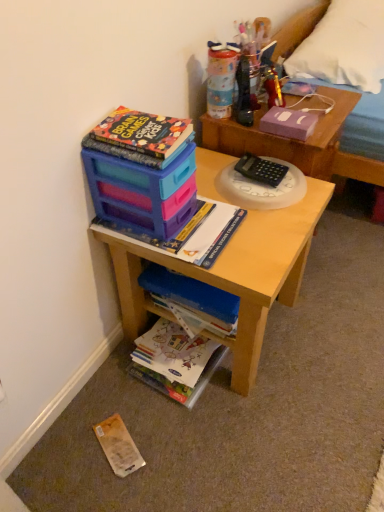
Locate an element on the screen. This screenshot has height=512, width=384. vacant area that is in front of colored paper art at lower center, marked as the fourth book in a top-to-bottom arrangement is located at coordinates (169, 432).